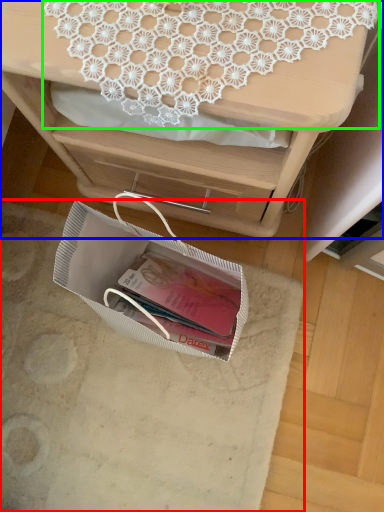
Question: Which object is positioned closest to place mat (highlighted by a red box)? Select from desk (highlighted by a blue box) and lace (highlighted by a green box).

Choices:
 (A) desk
 (B) lace

Answer: (A)